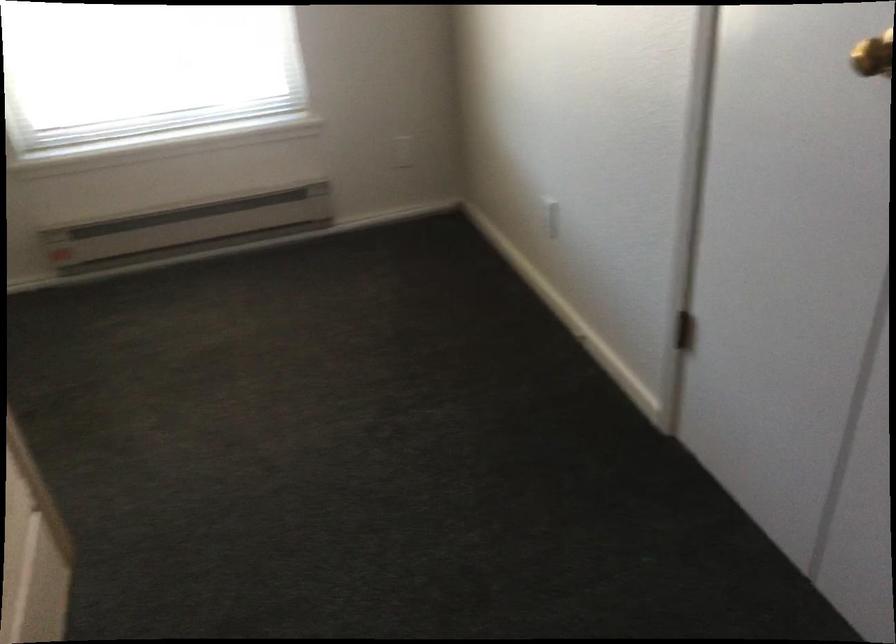
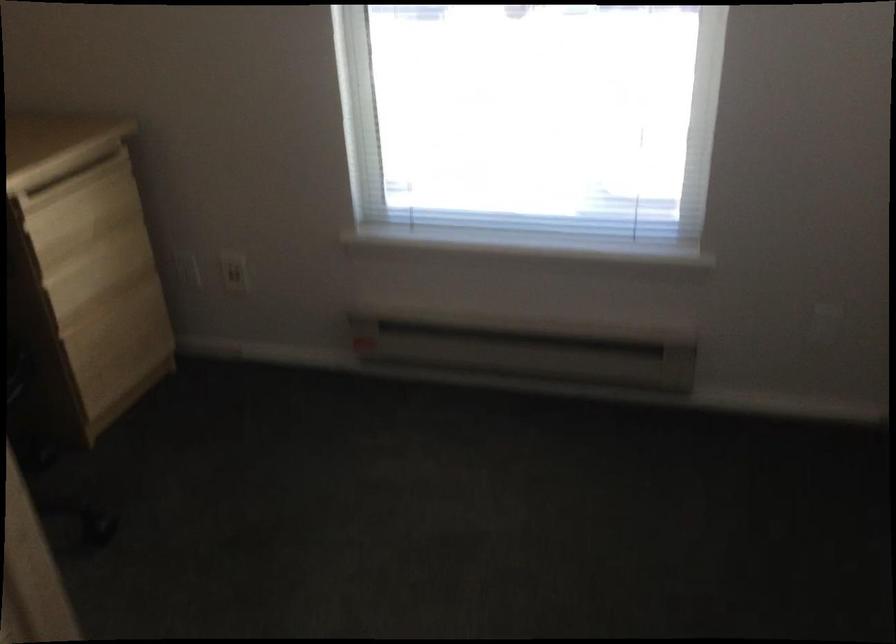
Question: The images are taken continuously from a first-person perspective. In which direction is your viewpoint rotating?

Choices:
 (A) Left
 (B) Right
 (C) Up
 (D) Down

Answer: (A)